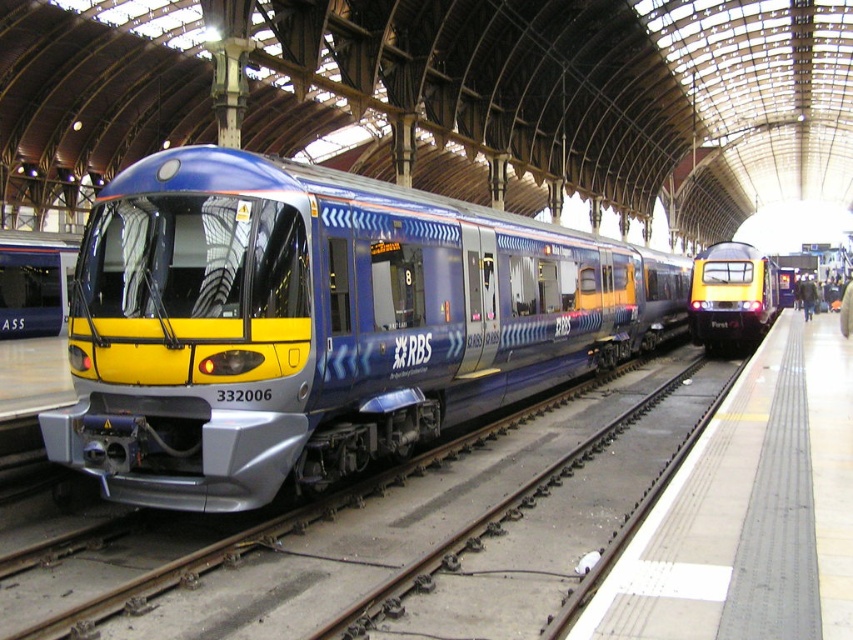
Is point (189, 618) closer to camera compared to point (679, 609)?

No, it is behind (679, 609).

In the scene shown: Can you confirm if metallic train track at center is positioned below gray concrete platform at right?

Yes.

Between point (286, 532) and point (813, 458), which one is positioned behind?

Point (813, 458)

This screenshot has height=640, width=853. What are the coordinates of `metallic train track at center` in the screenshot? It's located at (397, 536).

Which is more to the right, yellow glossy train at right or matte blue train at center?

yellow glossy train at right

Does yellow glossy train at right appear over matte blue train at center?

Incorrect, yellow glossy train at right is not positioned above matte blue train at center.

Locate an element on the screen. yellow glossy train at right is located at coordinates (730, 296).

Where is `yellow glossy train at right`? Image resolution: width=853 pixels, height=640 pixels. yellow glossy train at right is located at coordinates (730, 296).

Describe the element at coordinates (317, 323) in the screenshot. The width and height of the screenshot is (853, 640). I see `metallic blue train at center` at that location.

Which is behind, point (134, 360) or point (485, 550)?

Positioned behind is point (485, 550).

Between point (495, 294) and point (85, 634), which one is positioned in front?

Point (85, 634) is more forward.

The height and width of the screenshot is (640, 853). In order to click on metallic blue train at center in this screenshot , I will do `click(317, 323)`.